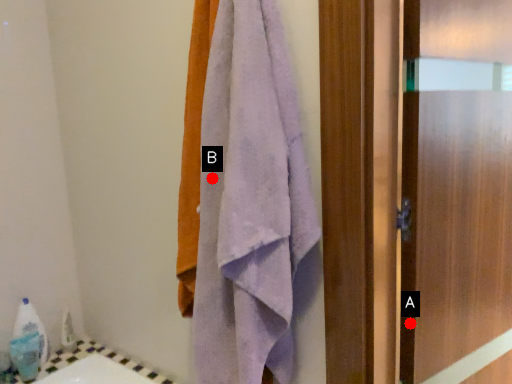
Question: Two points are circled on the image, labeled by A and B beside each circle. Which of the following is the farthest from the observer?

Choices:
 (A) A is further
 (B) B is further

Answer: (A)